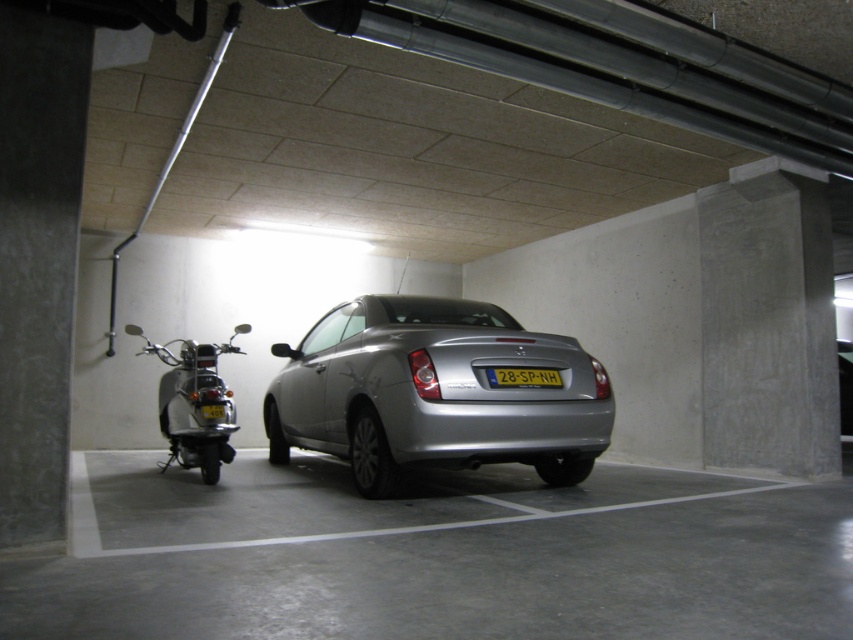
Can you confirm if silver metallic car at center is smaller than shiny chrome scooter at left?

No, silver metallic car at center is not smaller than shiny chrome scooter at left.

Between silver metallic car at center and shiny chrome scooter at left, which one has less height?

With less height is shiny chrome scooter at left.

Identify the location of silver metallic car at center. This screenshot has width=853, height=640. (434, 392).

Is point (170, 358) farther from viewer compared to point (532, 380)?

That is True.

Who is more forward, (202, 364) or (497, 369)?

Point (497, 369)

Image resolution: width=853 pixels, height=640 pixels. Identify the location of shiny chrome scooter at left. (194, 403).

Is silver metallic car at center wider than yellow plastic license plate at center?

Indeed, silver metallic car at center has a greater width compared to yellow plastic license plate at center.

From the picture: Can you confirm if silver metallic car at center is positioned above yellow plastic license plate at center?

No.

Image resolution: width=853 pixels, height=640 pixels. Find the location of `silver metallic car at center`. silver metallic car at center is located at coordinates (434, 392).